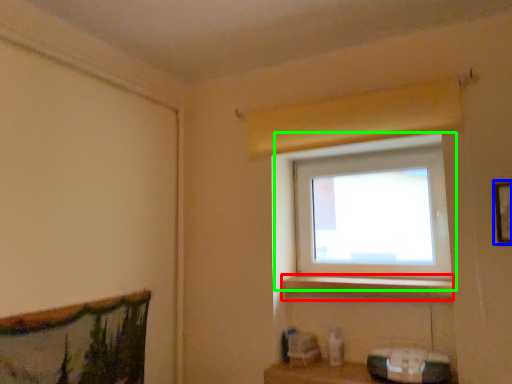
Question: Which object is the closest to the window sill (highlighted by a red box)? Choose among these: picture frame (highlighted by a blue box) or window (highlighted by a green box).

Choices:
 (A) picture frame
 (B) window

Answer: (B)